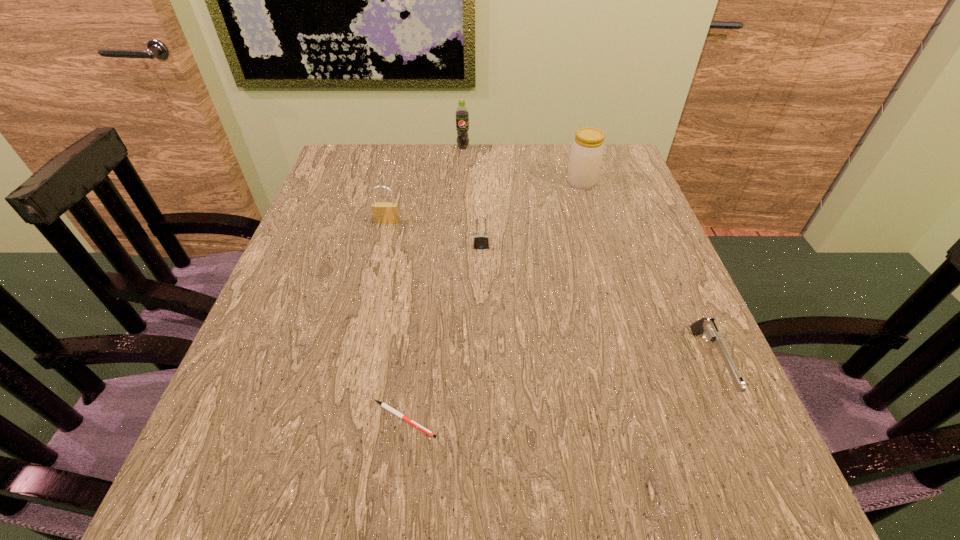
What are the coordinates of `vacant space situated on the front label of the farthest object` in the screenshot? It's located at (461, 198).

Find the location of a particular element. vacant region located 0.190m on the left of the jar is located at coordinates (494, 183).

Where is `vacant region located 0.390m on the front-facing side of the third tallest object`? vacant region located 0.390m on the front-facing side of the third tallest object is located at coordinates (353, 363).

Locate an element on the screen. The image size is (960, 540). free space located 0.380m on the shackle of the fourth tallest object is located at coordinates (482, 406).

You are a GUI agent. You are given a task and a screenshot of the screen. Output one action in this format:
    pyautogui.click(x=<x>, y=<y>)
    Task: Click on the blank space located on the front-facing side of the pistol
    
    Given the screenshot: What is the action you would take?
    pyautogui.click(x=758, y=481)

Identify the location of vacant space located 0.230m on the clicker of the shortest object. The width and height of the screenshot is (960, 540). (584, 419).

Find the location of a particular element. soda located in the far edge section of the desktop is located at coordinates (462, 115).

Locate an element on the screen. The width and height of the screenshot is (960, 540). jar at the far edge is located at coordinates coord(587,150).

Identify the location of jar that is at the right edge. (587, 150).

This screenshot has height=540, width=960. Identify the location of pistol located in the right edge section of the desktop. (708, 328).